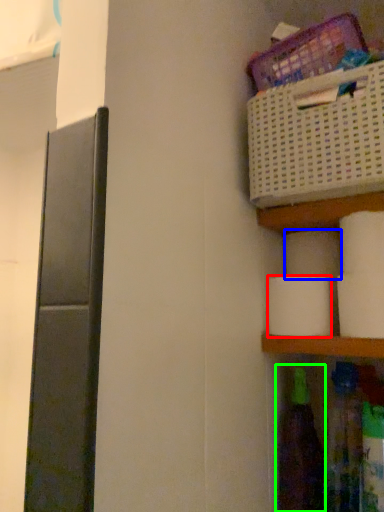
Question: Considering the real-world distances, which object is farthest from toilet paper (highlighted by a red box)? toilet paper (highlighted by a blue box) or bottle (highlighted by a green box)?

Choices:
 (A) toilet paper
 (B) bottle

Answer: (B)